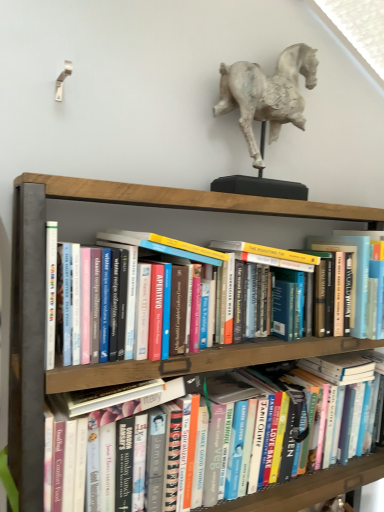
Question: In the image, is white plaster horse at upper center positioned in front of or behind wooden bookshelf at center?

Choices:
 (A) front
 (B) behind

Answer: (B)

Question: Considering the positions of point (289, 97) and point (254, 353), is point (289, 97) closer or farther from the camera than point (254, 353)?

Choices:
 (A) closer
 (B) farther

Answer: (B)

Question: Which object is the farthest from the hardcover book at center?

Choices:
 (A) wooden bookshelf at center
 (B) white plaster horse at upper center

Answer: (B)

Question: Considering the real-world distances, which object is closest to the wooden bookshelf at center?

Choices:
 (A) white plaster horse at upper center
 (B) hardcover book at center

Answer: (A)